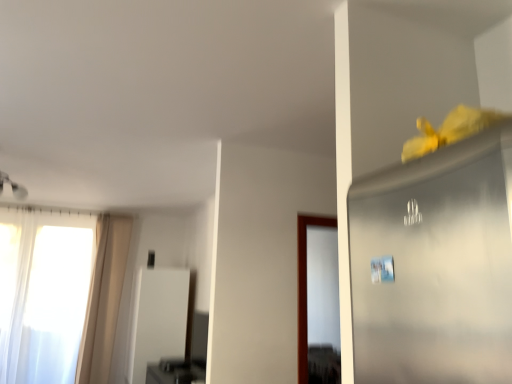
Question: Is beige fabric curtain at left in front of or behind white glossy screen door at center in the image?

Choices:
 (A) front
 (B) behind

Answer: (B)

Question: Considering the positions of beige fabric curtain at left and white glossy screen door at center in the image, is beige fabric curtain at left wider or thinner than white glossy screen door at center?

Choices:
 (A) thin
 (B) wide

Answer: (A)

Question: Which is nearer to the white glossy screen door at center?

Choices:
 (A) beige fabric curtain at left
 (B) white sheer curtain at left

Answer: (A)

Question: Based on their relative distances, which object is farther from the white sheer curtain at left?

Choices:
 (A) white glossy screen door at center
 (B) beige fabric curtain at left

Answer: (A)